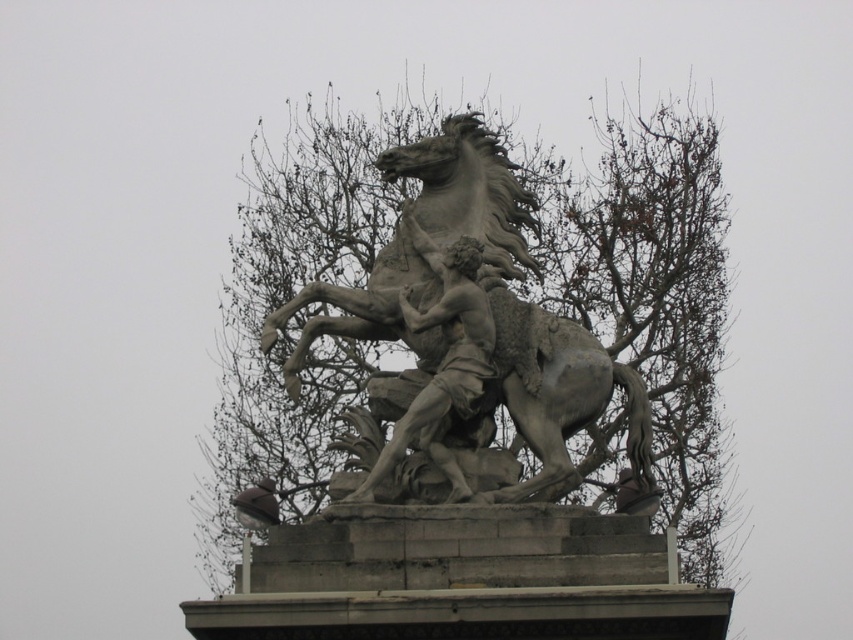
You are a painter standing 5 meters away from the smooth gray statue at center. You want to paint the gray stone horse at center. Can you reach it without moving closer than your current position?

The distance between the gray stone horse at center and the smooth gray statue at center is 7.17 meters. Since you are 5 meters away from the smooth gray statue at center, you are 12.17 meters away from the gray stone horse at center. Therefore, you cannot reach it without moving closer.

You are standing in front of the classical sculpture of a man riding a rearing horse. You notice two points marked on the statue. The first point is at coordinates point (302, 608) and the second point is at coordinates point (439, 307). Which of these two points is closer to you?

Point (302, 608) is in front of point (439, 307), so it is closer to you.

You are a photographer standing in front of the classical sculpture. You notice the gray stone horse at center and the smooth gray statue at center. Which object is positioned to the left side of the other?

The gray stone horse at center is to the left of the smooth gray statue at center.